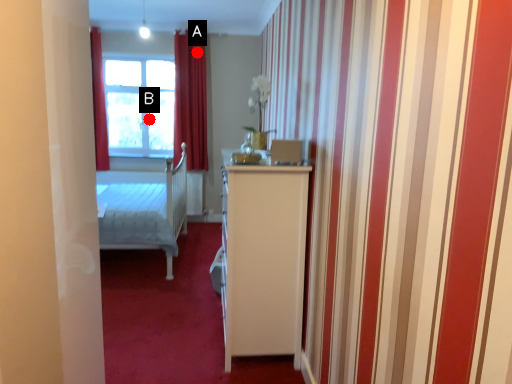
Question: Two points are circled on the image, labeled by A and B beside each circle. Which point appears closest to the camera in this image?

Choices:
 (A) A is closer
 (B) B is closer

Answer: (A)